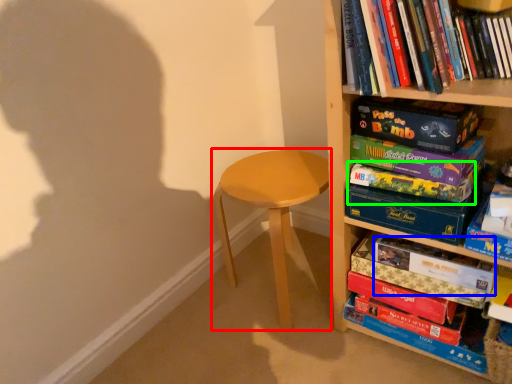
Question: Based on their relative distances, which object is nearer to stool (highlighted by a red box)? Choose from paperback book (highlighted by a blue box) and paperback book (highlighted by a green box).

Choices:
 (A) paperback book
 (B) paperback book

Answer: (B)